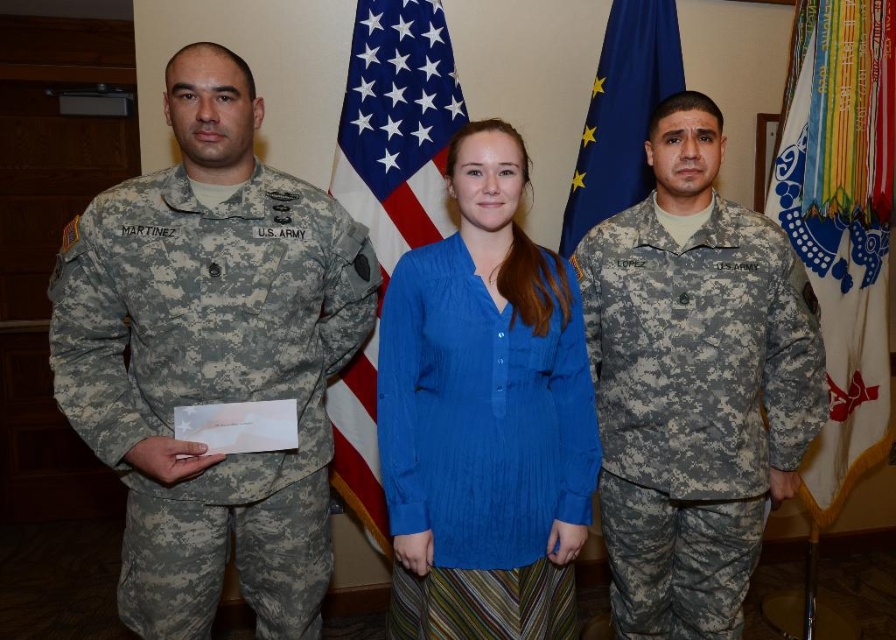
Question: Does camouflage fabric uniform at left have a greater width compared to white fabric flag at right?

Choices:
 (A) no
 (B) yes

Answer: (B)

Question: Which of the following is the farthest from the observer?

Choices:
 (A) blue cotton blouse at center
 (B) camouflage fabric uniform at right
 (C) white fabric flag at right
 (D) blue fabric flag at center

Answer: (D)

Question: Which is farther from the blue cotton blouse at center?

Choices:
 (A) camouflage fabric uniform at right
 (B) blue fabric flag at center

Answer: (B)

Question: Estimate the real-world distances between objects in this image. Which object is closer to the camouflage fabric uniform at right?

Choices:
 (A) white fabric flag at right
 (B) blue cotton blouse at center

Answer: (B)

Question: Is white fabric flag at right smaller than blue fabric flag at center?

Choices:
 (A) no
 (B) yes

Answer: (A)

Question: Considering the relative positions of white fabric flag at right and blue fabric flag at center in the image provided, where is white fabric flag at right located with respect to blue fabric flag at center?

Choices:
 (A) right
 (B) left

Answer: (A)